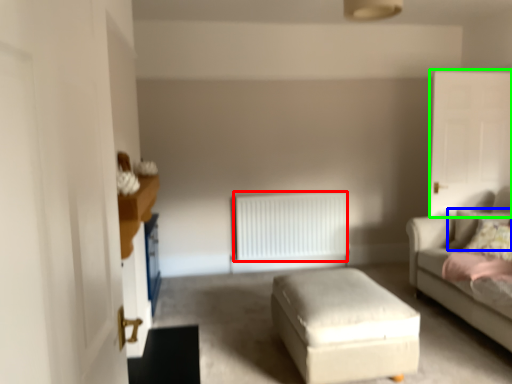
Question: Which object is positioned farthest from radiator (highlighted by a red box)? Select from pillow (highlighted by a blue box) and glass door (highlighted by a green box).

Choices:
 (A) pillow
 (B) glass door

Answer: (A)